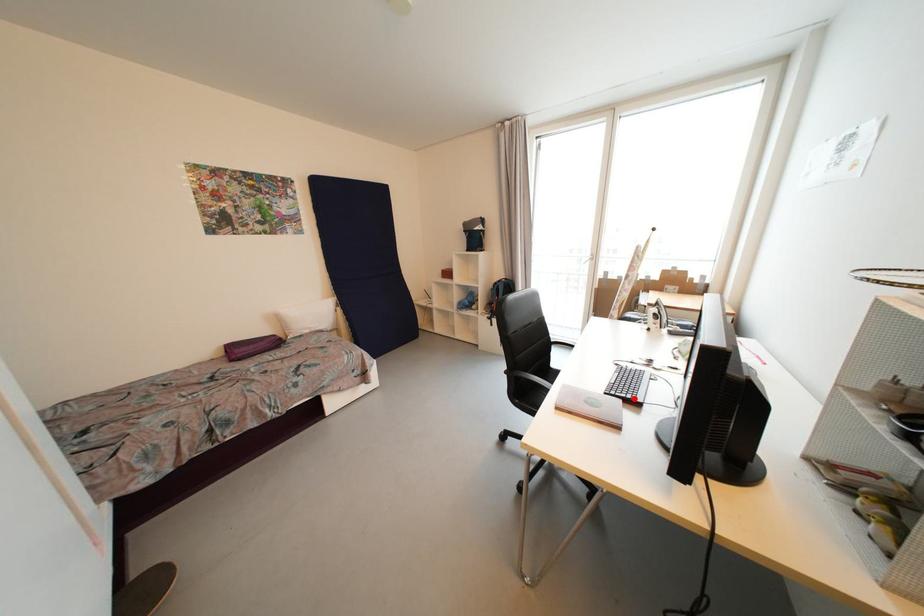
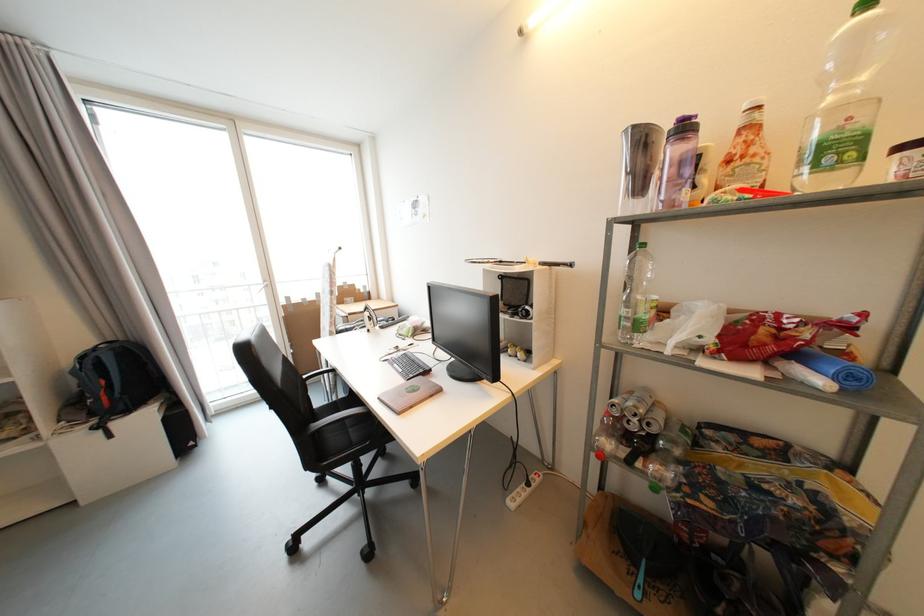
The point at the highlighted location is marked in the first image. Where is the corresponding point in the second image?

(427, 373)